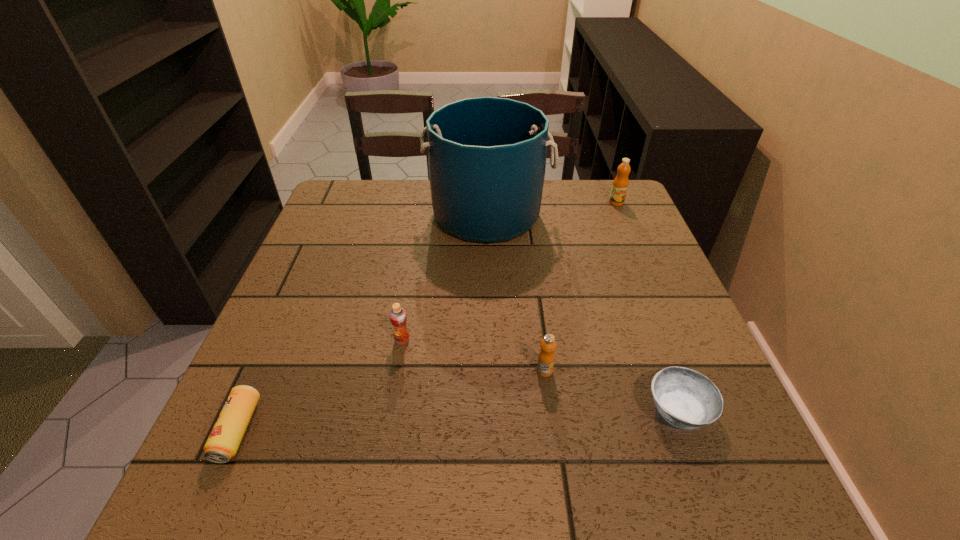
What are the coordinates of `unoccupied area between the bucket and the third farthest object` in the screenshot? It's located at (444, 278).

The image size is (960, 540). Find the location of `vacant space that's between the beer can and the second farthest orange juice`. vacant space that's between the beer can and the second farthest orange juice is located at coordinates (320, 385).

Locate an element on the screen. The image size is (960, 540). free space between the bucket and the leftmost orange juice is located at coordinates (444, 278).

Identify the location of blank region between the farthest orange juice and the fourth farthest object. The width and height of the screenshot is (960, 540). (581, 287).

The height and width of the screenshot is (540, 960). Find the location of `empty space that is in between the rightmost orange juice and the third nearest object`. empty space that is in between the rightmost orange juice and the third nearest object is located at coordinates (581, 287).

Locate an element on the screen. unoccupied area between the third nearest object and the second farthest orange juice is located at coordinates pos(473,355).

The image size is (960, 540). What are the coordinates of `vacant area that lies between the second tallest object and the leftmost object` in the screenshot? It's located at (427, 316).

You are a GUI agent. You are given a task and a screenshot of the screen. Output one action in this format:
    pyautogui.click(x=<x>, y=<y>)
    Task: Click on the fifth closest object relative to the tallest object
    The height and width of the screenshot is (540, 960).
    Given the screenshot: What is the action you would take?
    pyautogui.click(x=222, y=444)

Locate an element on the screen. This screenshot has width=960, height=540. object that is the third closest to the leftmost orange juice is located at coordinates (486, 155).

Locate an element on the screen. This screenshot has width=960, height=540. orange juice that is the second closest to the leftmost object is located at coordinates (546, 357).